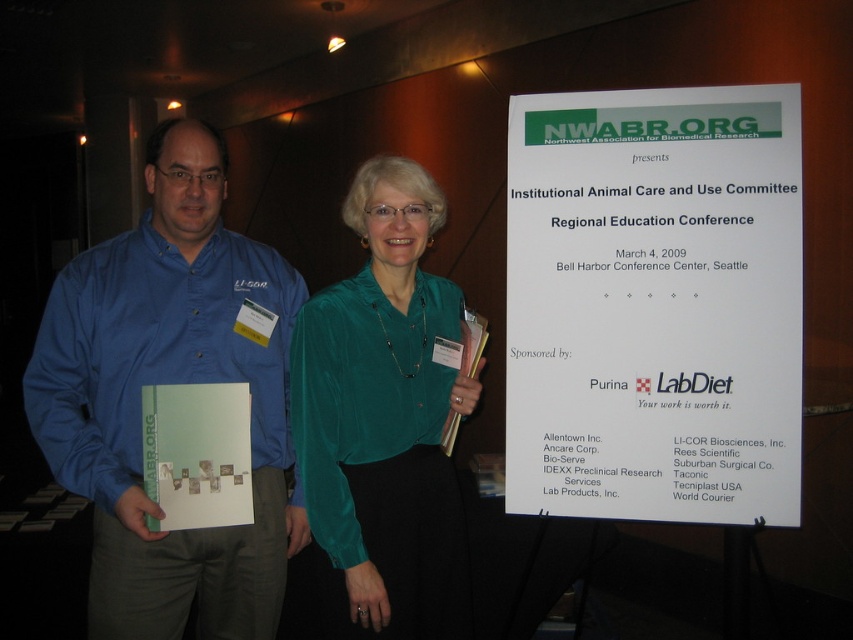
Question: Which of the following is the closest to the observer?

Choices:
 (A) (267, 595)
 (B) (346, 289)

Answer: (B)

Question: Which of the following is the closest to the observer?

Choices:
 (A) (90, 316)
 (B) (398, 513)

Answer: (A)

Question: Which point is farther from the camera taking this photo?

Choices:
 (A) (387, 301)
 (B) (32, 413)

Answer: (A)

Question: Does blue shirt at left appear on the right side of emerald satin blouse at center?

Choices:
 (A) no
 (B) yes

Answer: (A)

Question: Does blue shirt at left come in front of emerald satin blouse at center?

Choices:
 (A) no
 (B) yes

Answer: (B)

Question: Can you confirm if blue shirt at left is wider than emerald satin blouse at center?

Choices:
 (A) no
 (B) yes

Answer: (B)